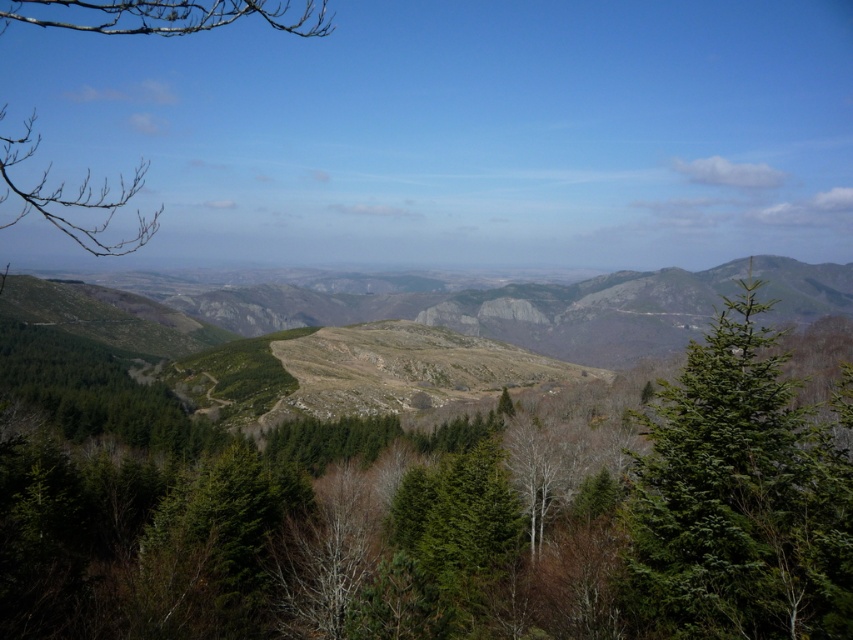
Question: Among these points, which one is farthest from the camera?

Choices:
 (A) (137, 166)
 (B) (836, 593)
 (C) (178, 314)
 (D) (660, 492)

Answer: (A)

Question: Which point is farther to the camera?

Choices:
 (A) green matte tree at right
 (B) green matte tree at center
 (C) rugged stone mountain at center
 (D) bare branches at upper left

Answer: (C)

Question: Is green matte tree at right to the right of bare branches at upper left from the viewer's perspective?

Choices:
 (A) yes
 (B) no

Answer: (A)

Question: Which point is closer to the camera?

Choices:
 (A) (738, 448)
 (B) (171, 10)

Answer: (B)

Question: Does green matte tree at center come in front of rugged stone mountain at center?

Choices:
 (A) no
 (B) yes

Answer: (B)

Question: Is green matte tree at right thinner than bare branches at upper left?

Choices:
 (A) yes
 (B) no

Answer: (A)